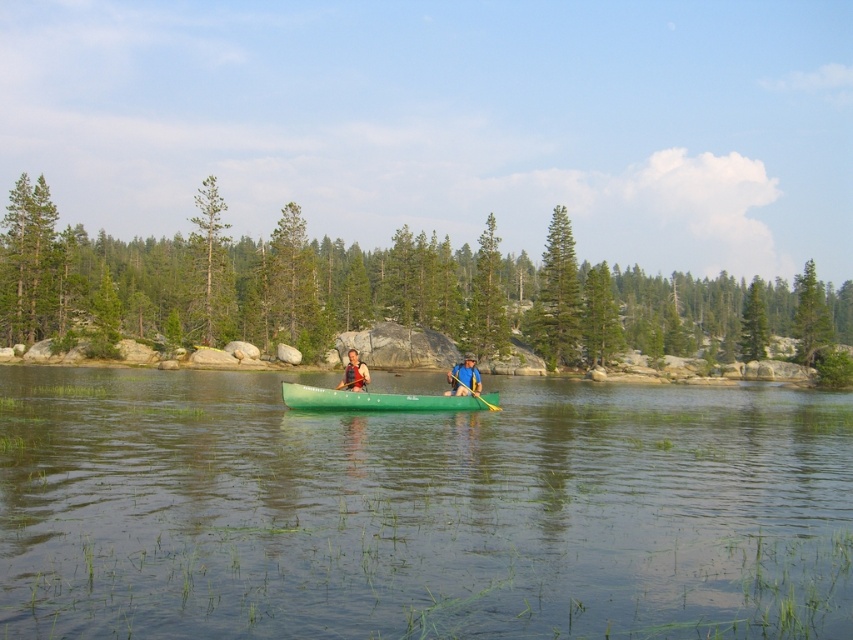
You are planning to rent a canoe for a family trip. You see two canoes in the image, the green plastic canoe at center and the matte green canoe at center. Which one is larger?

The matte green canoe at center is larger than the green plastic canoe at center.

You are a photographer standing at the edge of the water. You want to capture a photo of the clear water at center and the blue fabric jacket at center. If your camera can focus on objects up to 10 meters away, will both subjects be in focus?

The clear water at center is 11.16 meters away from the blue fabric jacket at center. Since the camera can only focus up to 10 meters, the clear water at center is beyond the camera range and will be out of focus, while the blue fabric jacket at center may be in focus if it is within 10 meters.